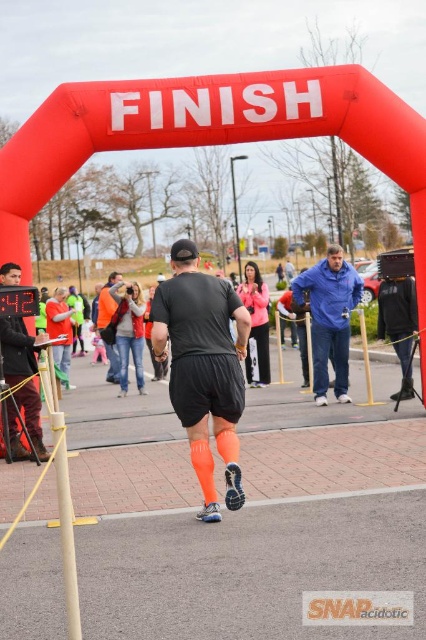
You are a photographer positioned at the camera. You want to take a closeup shot of the runner. The matte black shorts at center is 16.03 feet away from camera. Is the distance sufficient for a clear closeup?

The matte black shorts at center is 16.03 feet away from camera. This distance may be too far for a clear closeup shot, as typical closeup photography requires the subject to be within a few feet of the camera lens.

You are a photographer at the finish line. You need to capture a photo that shows both the matte black shorts at center and the neon orange athletic socks at center. Which object should you focus on to ensure both are in the frame?

Both the matte black shorts at center and the neon orange athletic socks at center are positioned at the center of the image. Since the matte black shorts at center is on the left side of the neon orange athletic socks at center, focusing on the center area where both objects are located will ensure both are in the frame.